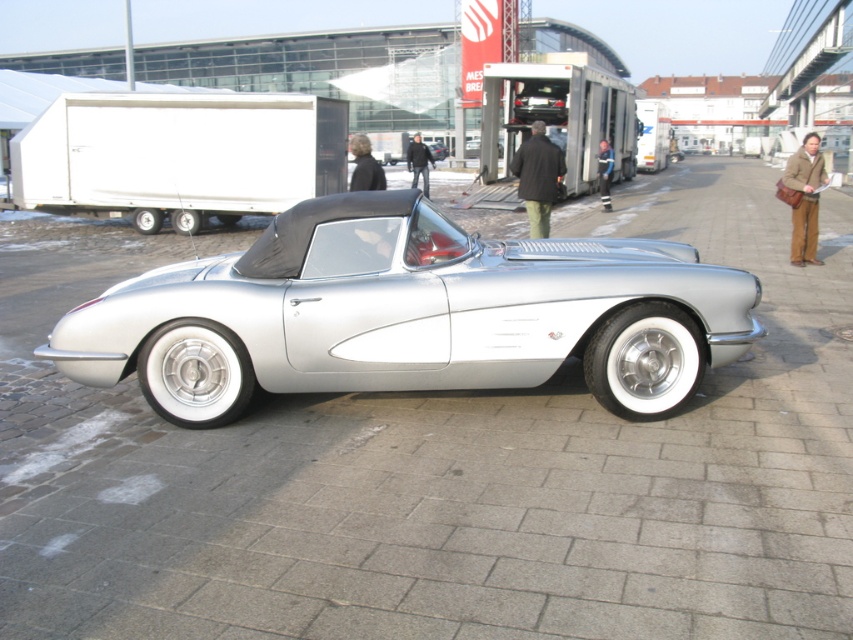
Question: Considering the real-world distances, which object is farthest from the metallic silver truck at center?

Choices:
 (A) green pants at center
 (B) brown leather jacket at right

Answer: (A)

Question: Which point is farther to the camera?

Choices:
 (A) dark brown leather jacket at center
 (B) brown leather jacket at right
 (C) silver metallic sports car at center

Answer: (B)

Question: Which object appears farthest from the camera in this image?

Choices:
 (A) dark brown leather jacket at center
 (B) green pants at center

Answer: (B)

Question: Is silver metallic sports car at center to the left of silver metallic car at center from the viewer's perspective?

Choices:
 (A) no
 (B) yes

Answer: (B)

Question: Is green pants at center smaller than dark gray jacket at center?

Choices:
 (A) no
 (B) yes

Answer: (B)

Question: Can you confirm if matte white trailer at left is thinner than green pants at center?

Choices:
 (A) yes
 (B) no

Answer: (B)